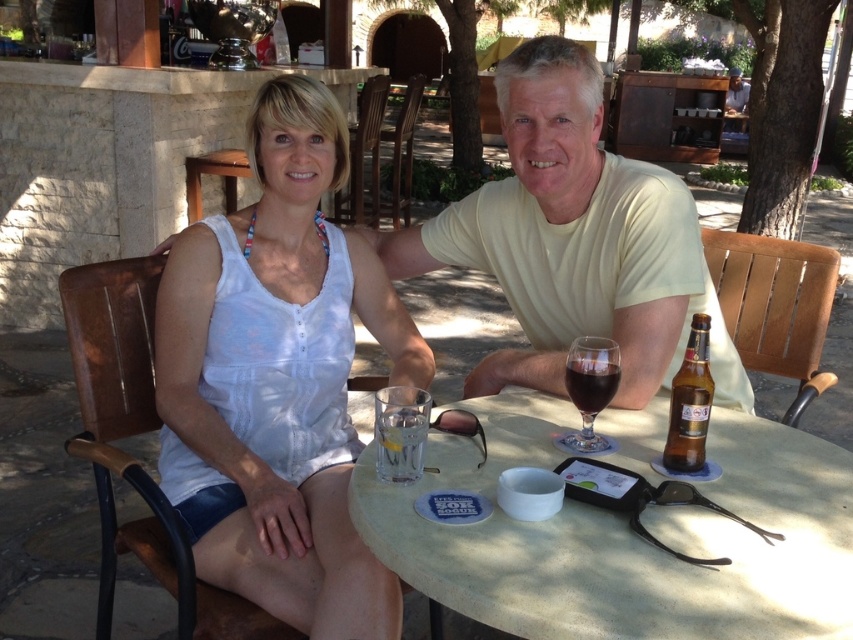
You are a photographer trying to capture a closeup shot of the yellow cotton shirt at center and the dark glass wine at center. Given that your camera can only focus on objects within 18 inches of each other, will you be able to take the photo without moving any objects?

The yellow cotton shirt at center and dark glass wine at center are 19.14 inches apart, which is beyond the 18 inch focus range. Therefore, you cannot take the photo without moving the objects closer together.

What is the exact location of the white fabric tank top at center in the image?

The white fabric tank top at center is located at point (277,378).

You are a photographer taking a picture of the yellow cotton shirt at center and the dark glass wine at center. Which object should you focus on first if you want to capture both clearly in the same frame?

The yellow cotton shirt at center is located above the dark glass wine at center, so you should focus on the yellow cotton shirt at center first to ensure both are in focus since it is closer to the camera.